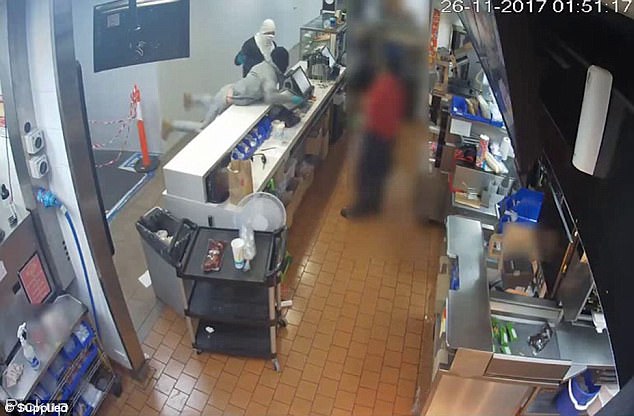
Where is `cup`? The image size is (634, 416). cup is located at coordinates (235, 245).